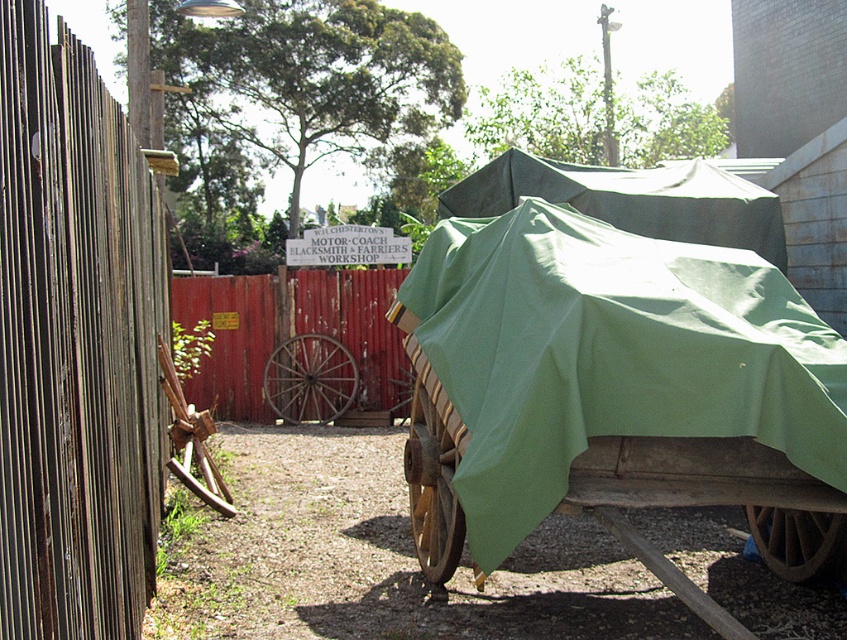
In the scene shown: You are standing in the outdoor scene and want to place a tall ladder that is 2 meters high. You have two options to place it against either the wooden planks at left or the red wood fence at center. Which object can the ladder fit against without exceeding its height?

The wooden planks at left is taller than the red wood fence at center, so the ladder can fit against the wooden planks at left since it is taller than the red wood fence at center.

You are a delivery person trying to park your truck which is 20 feet long. You see the wooden planks at left and the red wood fence at center. Is there enough space between them to park your truck?

The distance between wooden planks at left and red wood fence at center is 22.06 feet, which is longer than the truck length of 20 feet. Therefore, there is enough space to park the truck between them.

You are a delivery person trying to move a box from the wooden planks at left to the green fabric cart at center. The box is 10 feet long. Can you move the box without bending it?

The distance between the wooden planks at left and the green fabric cart at center is 11.39 feet, which is longer than the box length of 10 feet. Therefore, you can move the box without bending it.